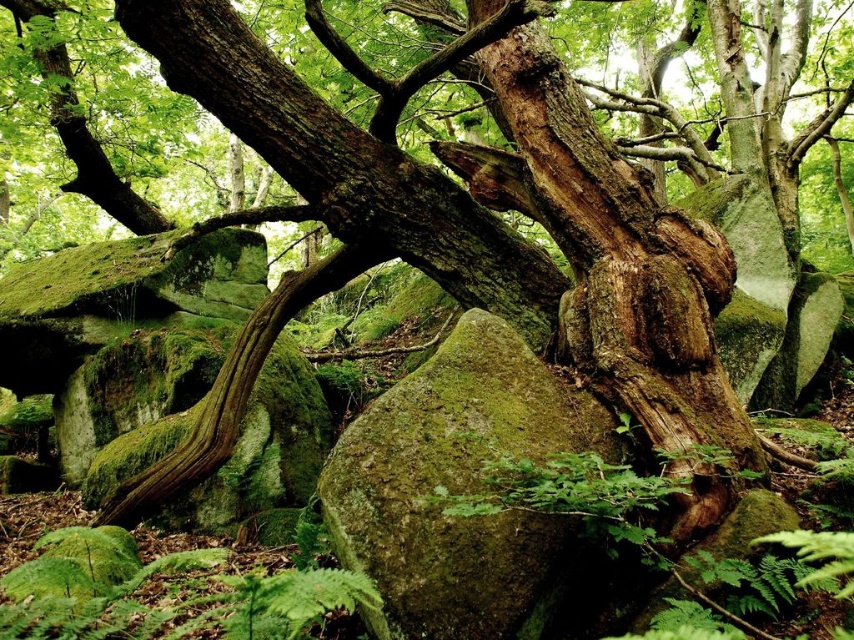
Between green mossy rock at center and green fuzzy fern at lower left, which one is positioned lower?

green fuzzy fern at lower left

Which is behind, point (341, 540) or point (250, 588)?

Point (341, 540)

Identify the location of green mossy rock at center. This screenshot has height=640, width=854. (464, 493).